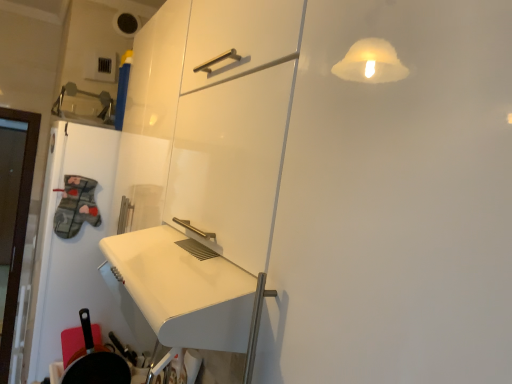
Question: From the image's perspective, is black matte frying pan at lower left positioned above or below white glossy door at left?

Choices:
 (A) below
 (B) above

Answer: (A)

Question: Is black matte frying pan at lower left in front of or behind white glossy door at left in the image?

Choices:
 (A) behind
 (B) front

Answer: (B)

Question: In terms of width, does black matte frying pan at lower left look wider or thinner when compared to white glossy door at left?

Choices:
 (A) thin
 (B) wide

Answer: (A)

Question: Is white glossy door at left wider or thinner than black matte frying pan at lower left?

Choices:
 (A) wide
 (B) thin

Answer: (A)

Question: From the image's perspective, relative to black matte frying pan at lower left, is white glossy door at left above or below?

Choices:
 (A) above
 (B) below

Answer: (A)

Question: Considering the positions of point (48, 236) and point (78, 362), is point (48, 236) closer or farther from the camera than point (78, 362)?

Choices:
 (A) closer
 (B) farther

Answer: (B)

Question: Considering the positions of white glossy door at left and black matte frying pan at lower left in the image, is white glossy door at left bigger or smaller than black matte frying pan at lower left?

Choices:
 (A) big
 (B) small

Answer: (A)